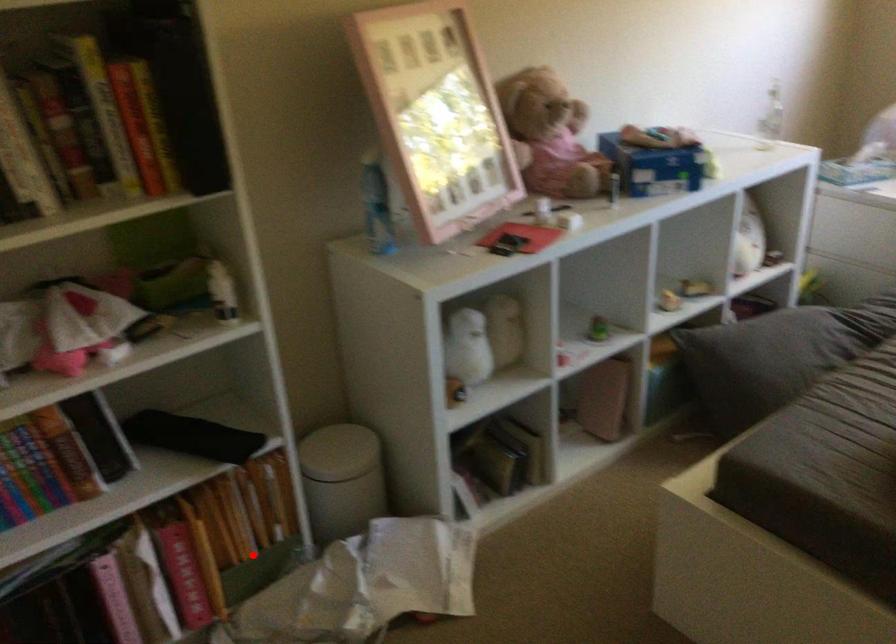
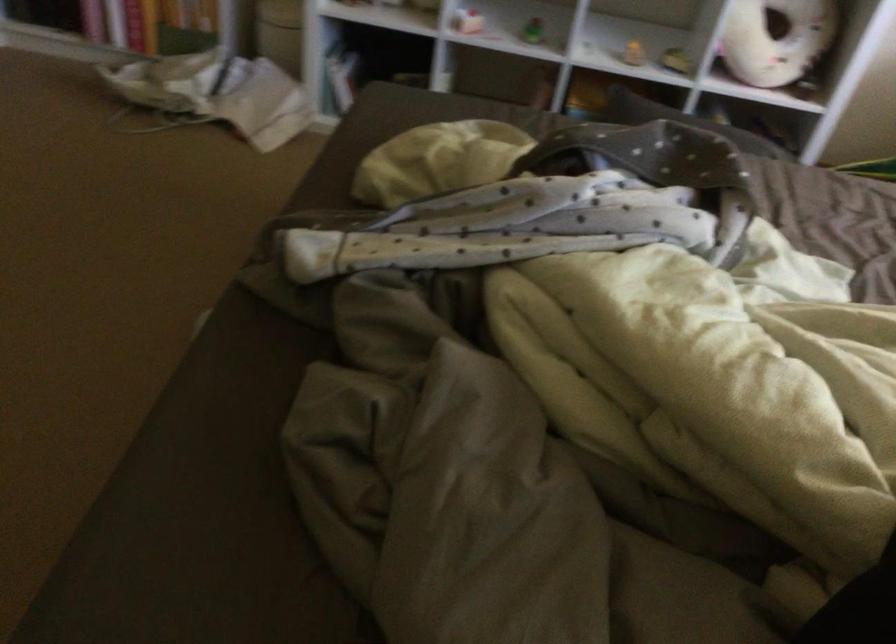
Question: I am providing you with two images of the same scene from different viewpoints. In image1, a red point is highlighted. Considering the same 3D point in image2, which of the following is correct?

Choices:
 (A) It is closer
 (B) It is farther

Answer: (B)